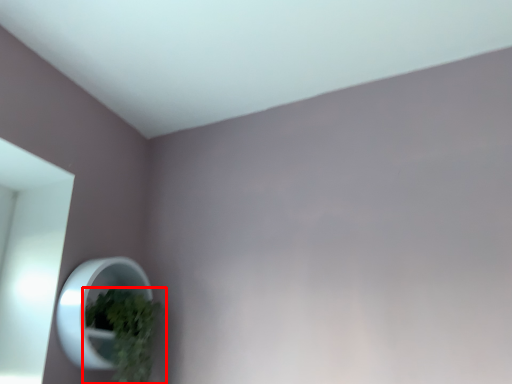
Question: Observing the image, what is the correct spatial positioning of houseplant (annotated by the red box) in reference to mirror?

Choices:
 (A) left
 (B) right

Answer: (B)